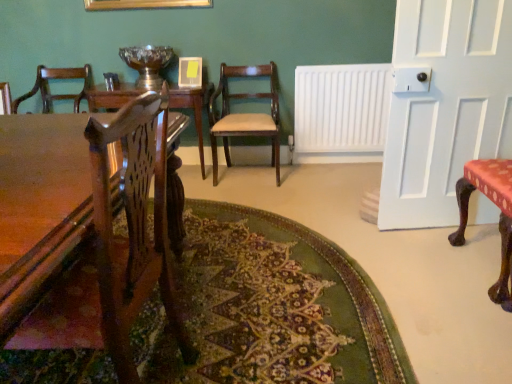
Find the location of a particular element. This screenshot has height=384, width=512. vacant region in front of white plastic radiator at center is located at coordinates pyautogui.click(x=343, y=175).